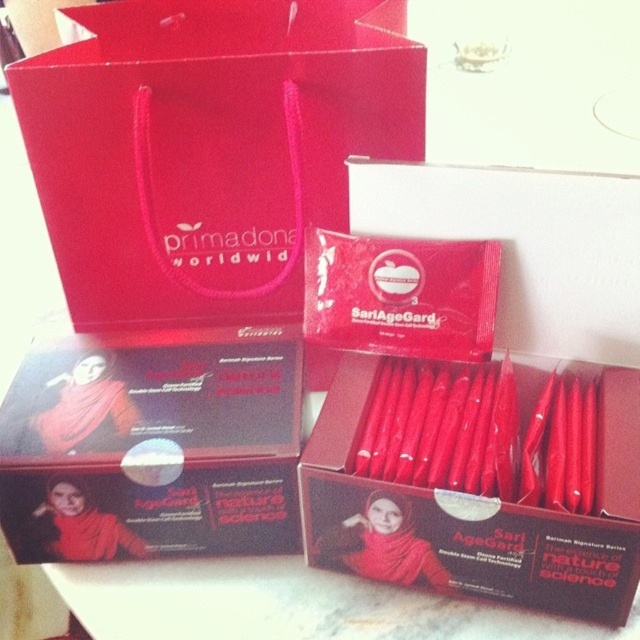
You are organizing items on a shelf and need to place the matte paper bag at upper left and the matte red packet at center. Which item should you place first if you want to arrange them from closest to farthest from the viewer?

You should place the matte paper bag at upper left first because it is closer to the viewer than the matte red packet at center.

In the scene shown: You are organizing a gift set and need to place both the matte red packet at center and the matte black box at center into a rectangular box that is 12 inches wide. Given their widths, will both items fit side by side without overlapping?

The matte red packet at center has a larger width than the matte black box at center. Since the total width of both items combined would exceed the 12 inches of the rectangular box, they cannot fit side by side without overlapping.